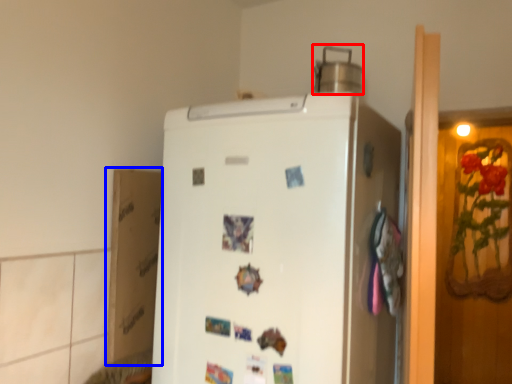
Question: Among these objects, which one is farthest to the camera, appliance (highlighted by a red box) or cardboard box (highlighted by a blue box)?

Choices:
 (A) appliance
 (B) cardboard box

Answer: (A)